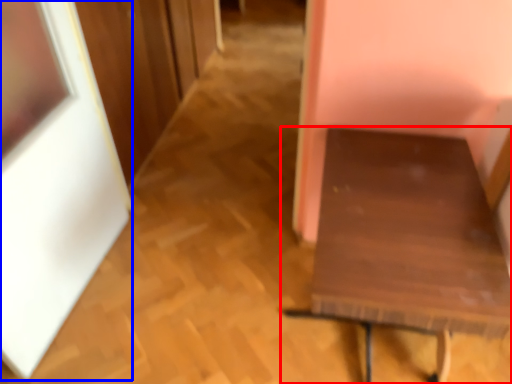
Question: Which of the following is the farthest to the observer, furniture (highlighted by a red box) or picture frame (highlighted by a blue box)?

Choices:
 (A) furniture
 (B) picture frame

Answer: (A)